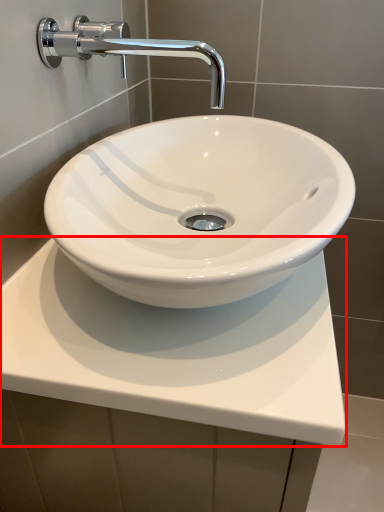
Question: Where is counter top (annotated by the red box) located in relation to tap in the image?

Choices:
 (A) right
 (B) left

Answer: (A)